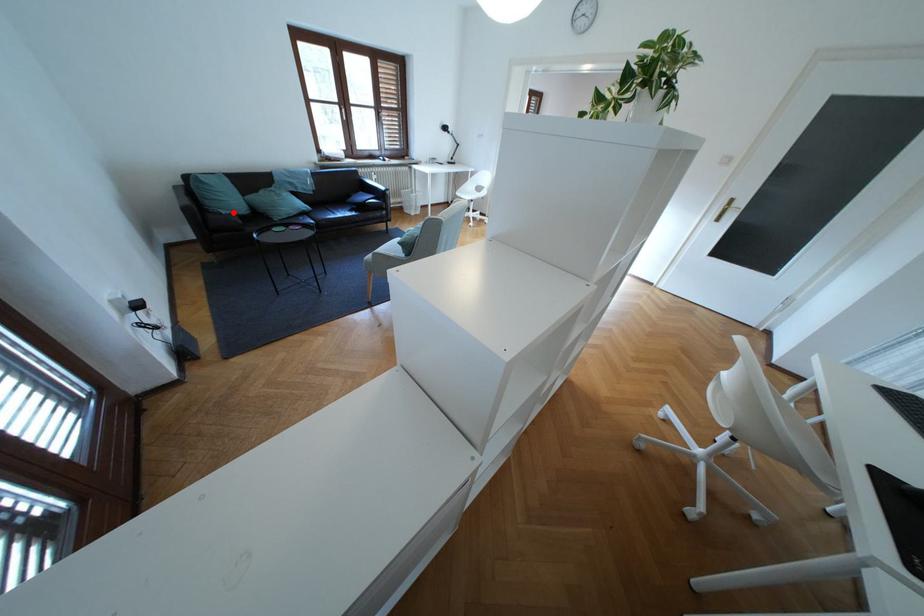
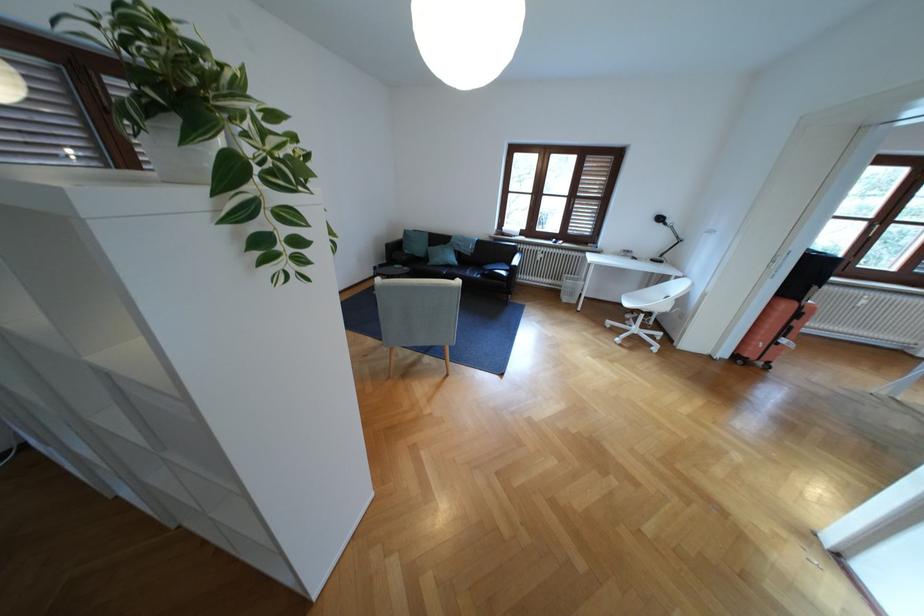
Find the pixel in the second image that matches the highlighted location in the first image.

(417, 252)